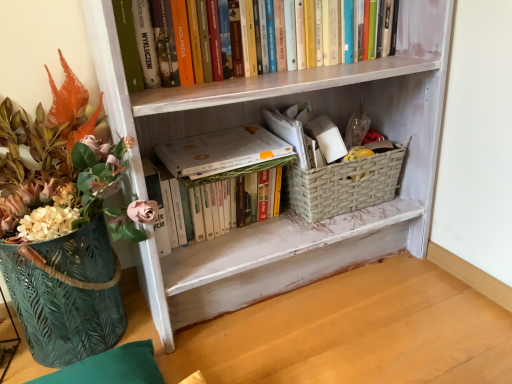
At what (x,y) coordinates should I click in order to perform the action: click on vacant area that is in front of white painted wood bookcase at center. Please return your answer as a coordinate pair (x, y). The width and height of the screenshot is (512, 384). Looking at the image, I should click on (324, 341).